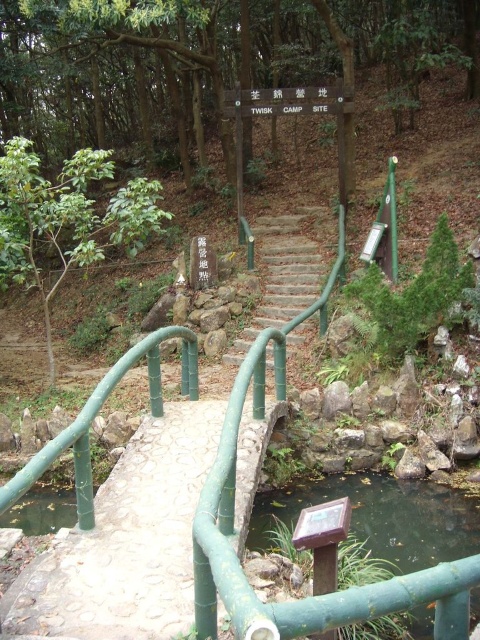
The height and width of the screenshot is (640, 480). Identify the location of green bamboo stream at lower center. 381,516.

Which is below, green bamboo stream at lower center or green bamboo stairs at center?

green bamboo stream at lower center

What do you see at coordinates (381, 516) in the screenshot?
I see `green bamboo stream at lower center` at bounding box center [381, 516].

Image resolution: width=480 pixels, height=640 pixels. Find the location of `green bamboo stream at lower center`. green bamboo stream at lower center is located at coordinates (381, 516).